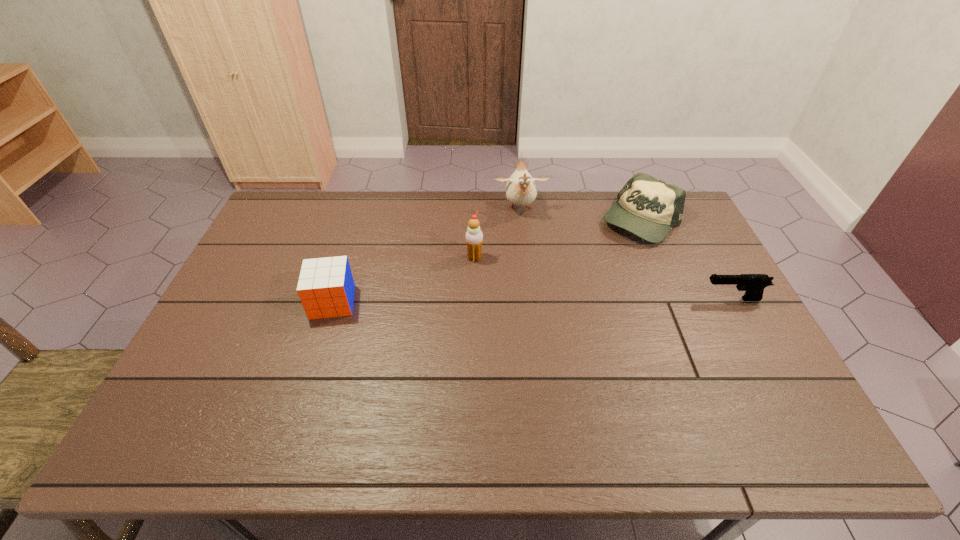
Locate an element on the screen. vacant space on the desktop that is between the leftmost object and the pistol and is positioned on the front-facing side of the baseball cap is located at coordinates click(x=531, y=301).

Identify the location of free spot on the desktop that is between the cube and the pistol and is positioned at the front with a straw on the fourth object from right to left. The image size is (960, 540). (567, 300).

The height and width of the screenshot is (540, 960). Identify the location of free spot on the desktop that is between the cube and the pistol and is positioned at the beak of the third object from right to left. (533, 301).